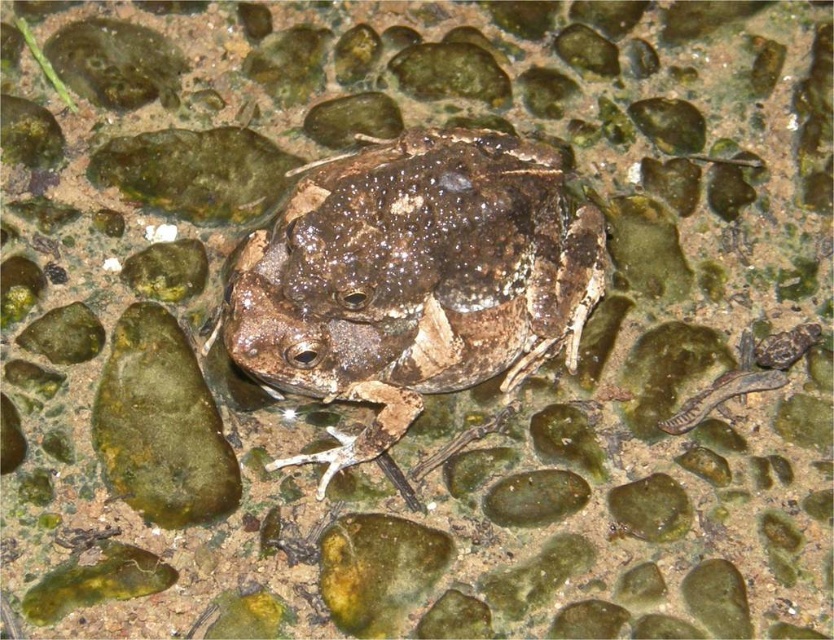
You are a photographer adjusting your camera focus. You need to focus on either point point (476, 288) or point (210, 416). Which point should you focus on to ensure the frog is in the foreground?

Point (476, 288) is closer to the viewer than point (210, 416), so focusing on point (476, 288) will ensure the frog is in the foreground.

You are a wildlife photographer aiming to capture the speckled brown skin at center in your shot. Based on the scene, where should you position your camera to ensure the frog is centered in the frame?

The speckled brown skin at center is located at point (x=413, y=278), so you should position your camera to aim directly at those coordinates to center the frog in your frame.